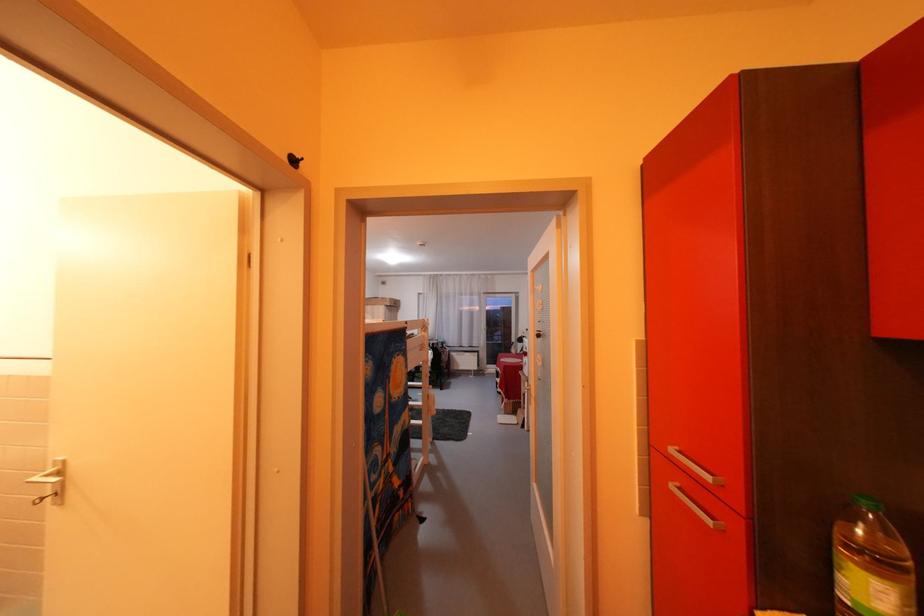
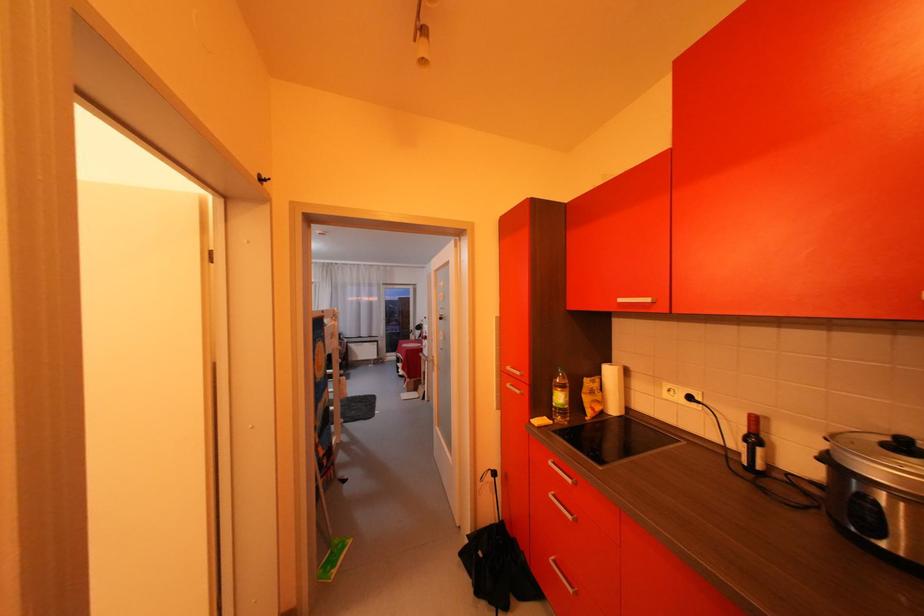
In a continuous first-person perspective shot, in which direction is the camera moving?

The cameraman walked toward left, backward.